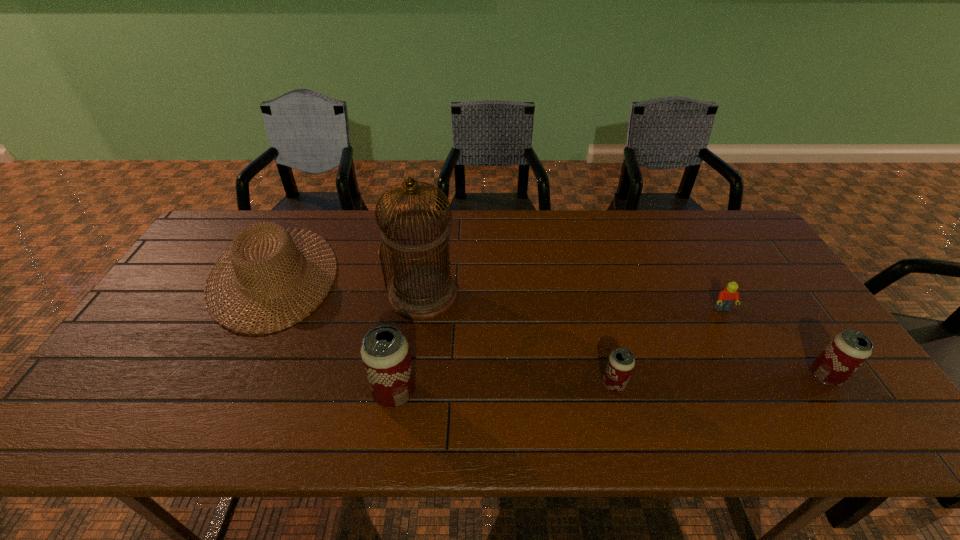
All beer cans are currently evenly spaced. To continue this pattern, where would you add another beer can on the left? Please point out a vacant spot. Please provide its 2D coordinates. Your answer should be formatted as a tuple, i.e. [(x, y)], where the tuple contains the x and y coordinates of a point satisfying the conditions above.

[(168, 401)]